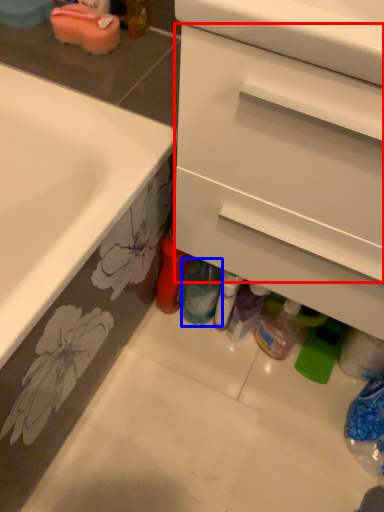
Question: Among these objects, which one is farthest to the camera, drawer (highlighted by a red box) or bottle (highlighted by a blue box)?

Choices:
 (A) drawer
 (B) bottle

Answer: (B)